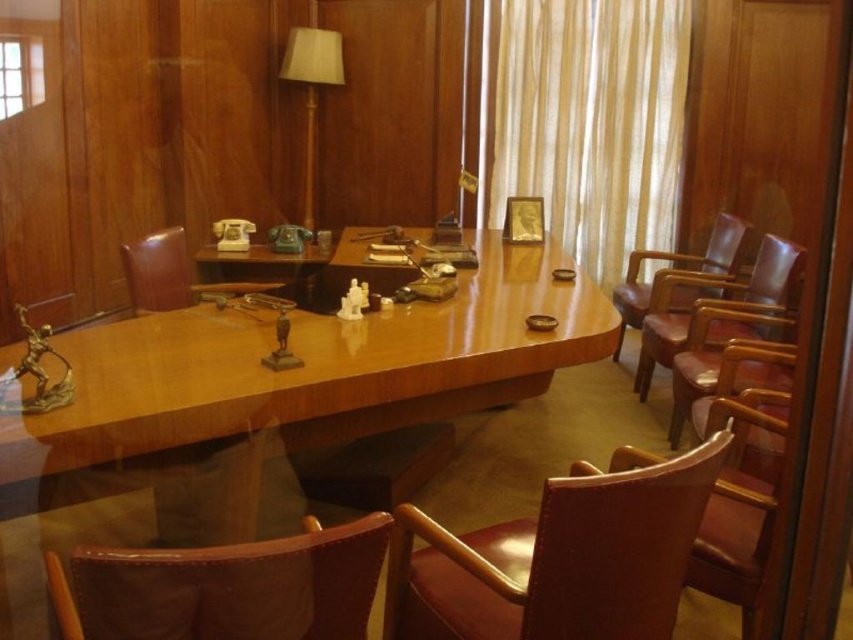
Question: Is wooden table at center thinner than leather chair at left?

Choices:
 (A) no
 (B) yes

Answer: (A)

Question: Is leather at lower left positioned behind brown leather chair at right?

Choices:
 (A) no
 (B) yes

Answer: (A)

Question: Does white sheer curtain at upper center have a smaller size compared to brown leather chair at right?

Choices:
 (A) no
 (B) yes

Answer: (A)

Question: Which point appears closest to the camera in this image?

Choices:
 (A) (64, 632)
 (B) (560, 145)
 (C) (328, 83)

Answer: (A)

Question: Which object is the closest to the leather at lower left?

Choices:
 (A) wooden table at center
 (B) leather chair at left
 (C) white sheer curtain at upper center

Answer: (A)

Question: Estimate the real-world distances between objects in this image. Which object is closer to the wooden table at center?

Choices:
 (A) brown leather chair at right
 (B) leather at center

Answer: (B)